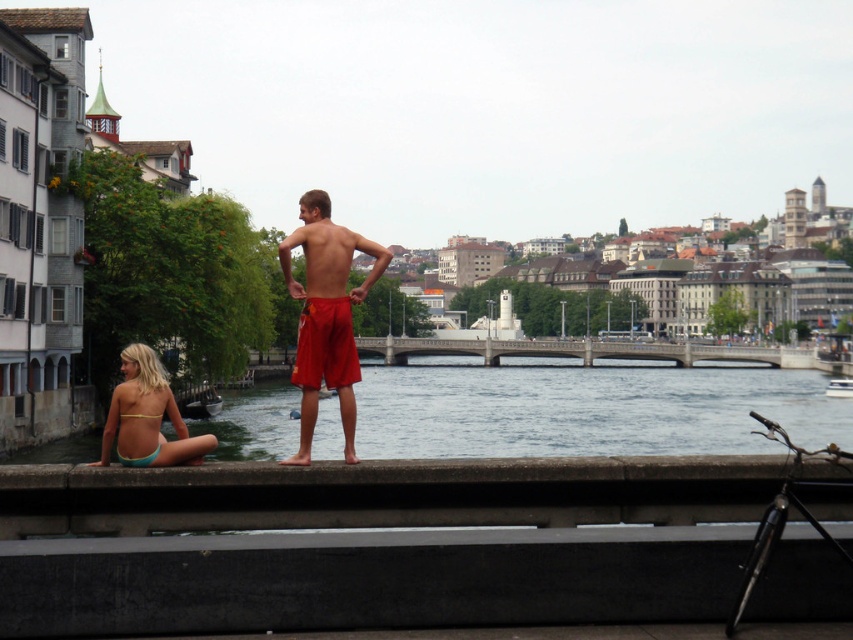
You are a photographer planning to take a photo of the matte red shorts at center and the light blue bikini at lower left. Which object should you focus on first if you want to capture both in a single shot without zooming in or out?

The matte red shorts at center has a larger size compared to the light blue bikini at lower left, so you should focus on the matte red shorts at center first to ensure it fits properly in the frame before adjusting for the smaller light blue bikini at lower left.